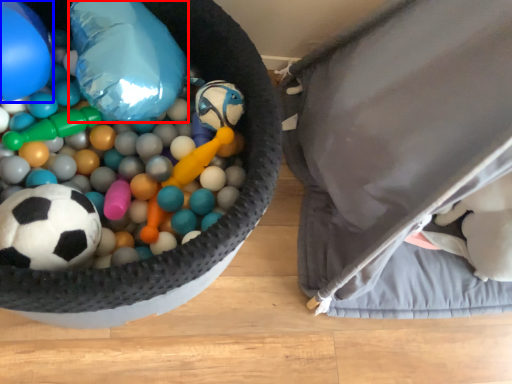
Question: Which object appears closest to the camera in this image, balloon (highlighted by a red box) or balloon (highlighted by a blue box)?

Choices:
 (A) balloon
 (B) balloon

Answer: (B)